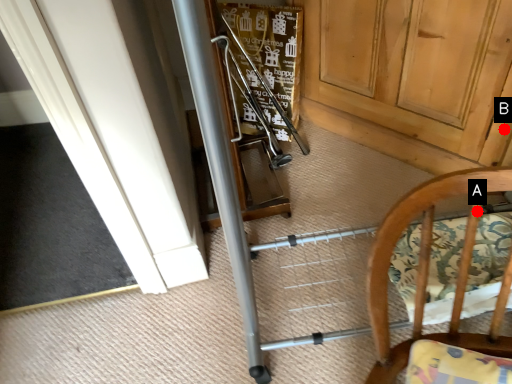
Question: Two points are circled on the image, labeled by A and B beside each circle. Among these points, which one is nearest to the camera?

Choices:
 (A) A is closer
 (B) B is closer

Answer: (A)